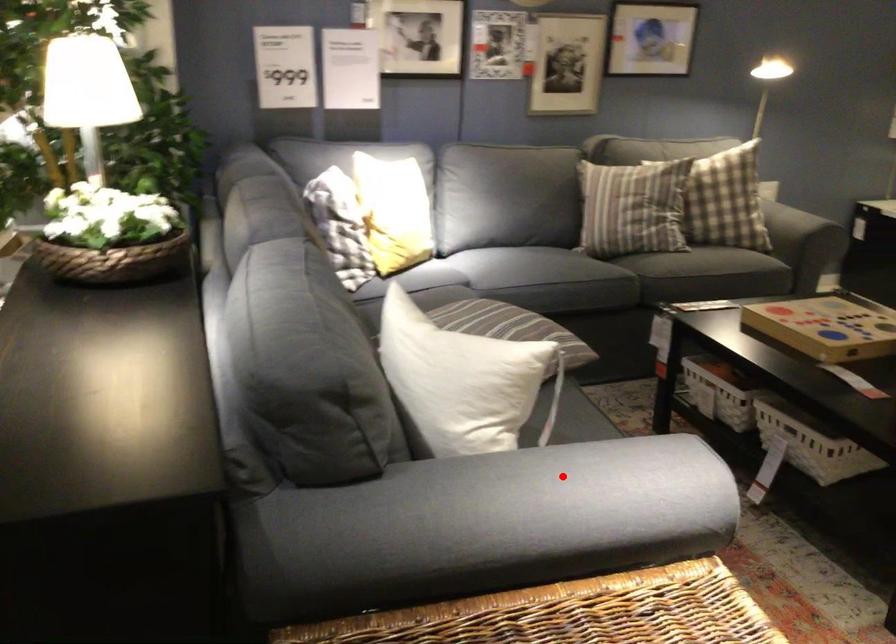
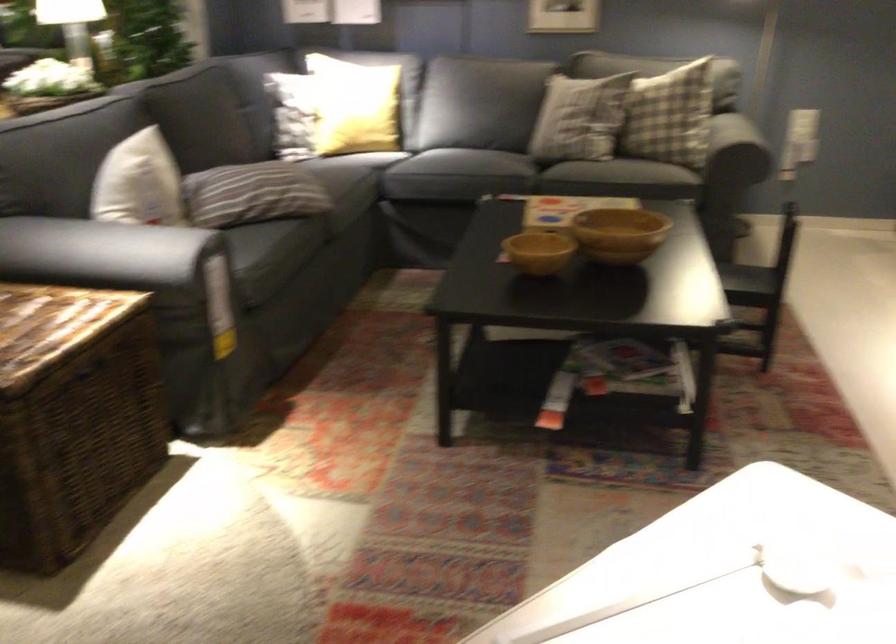
Question: I am providing you with two images of the same scene from different viewpoints. Given a red point in image1, look at the same physical point in image2. Is it:

Choices:
 (A) Closer to the viewpoint
 (B) Farther from the viewpoint

Answer: (B)